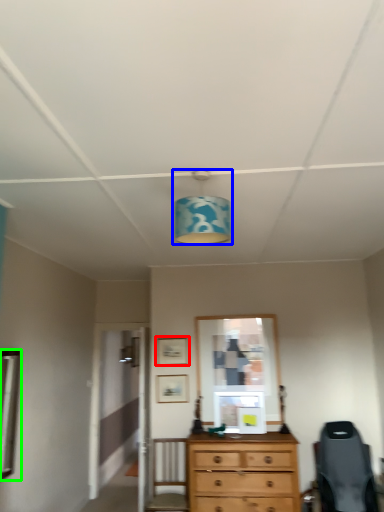
Question: Which object is the farthest from picture frame (highlighted by a red box)? Choose among these: light fixture (highlighted by a blue box) or mirror (highlighted by a green box).

Choices:
 (A) light fixture
 (B) mirror

Answer: (A)